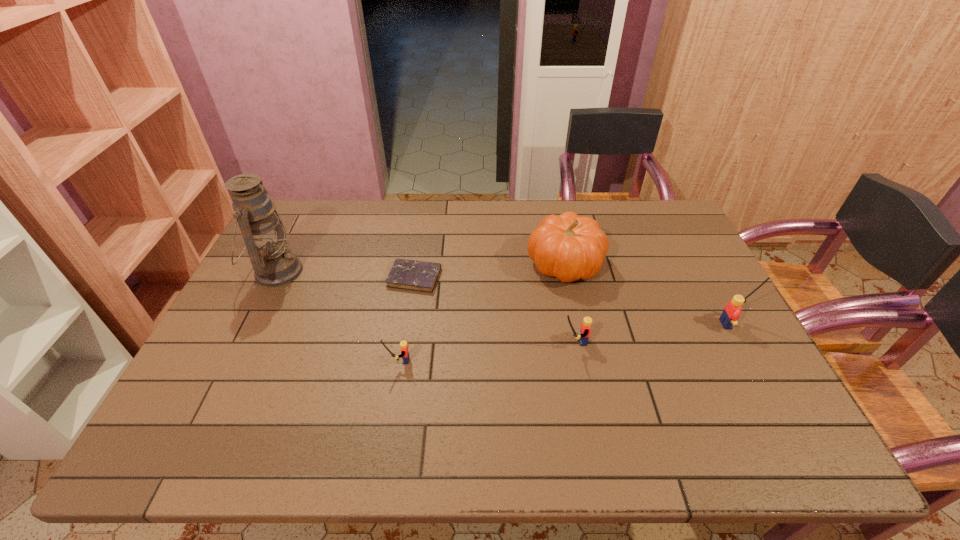
This screenshot has width=960, height=540. I want to click on vacant spot to place a Lego on the left, so click(209, 381).